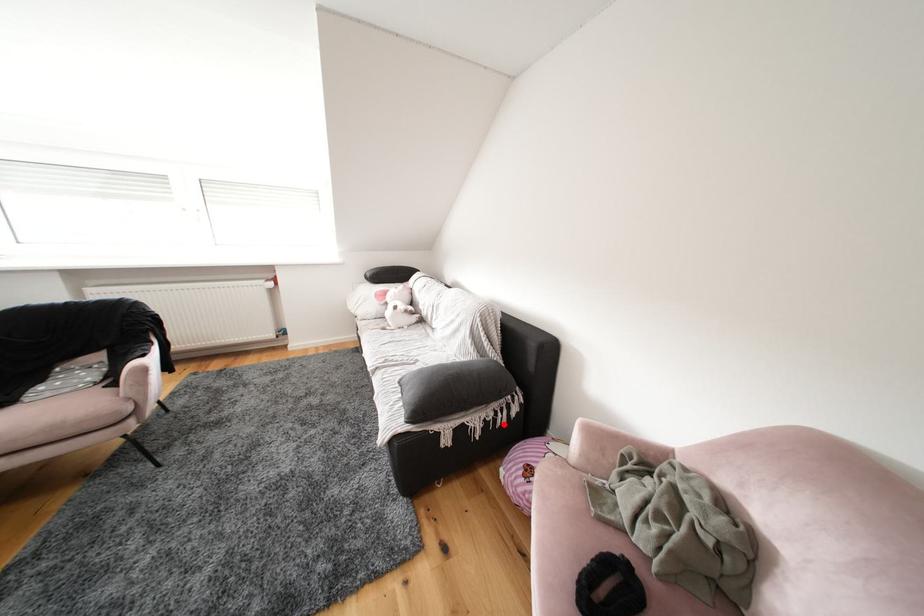
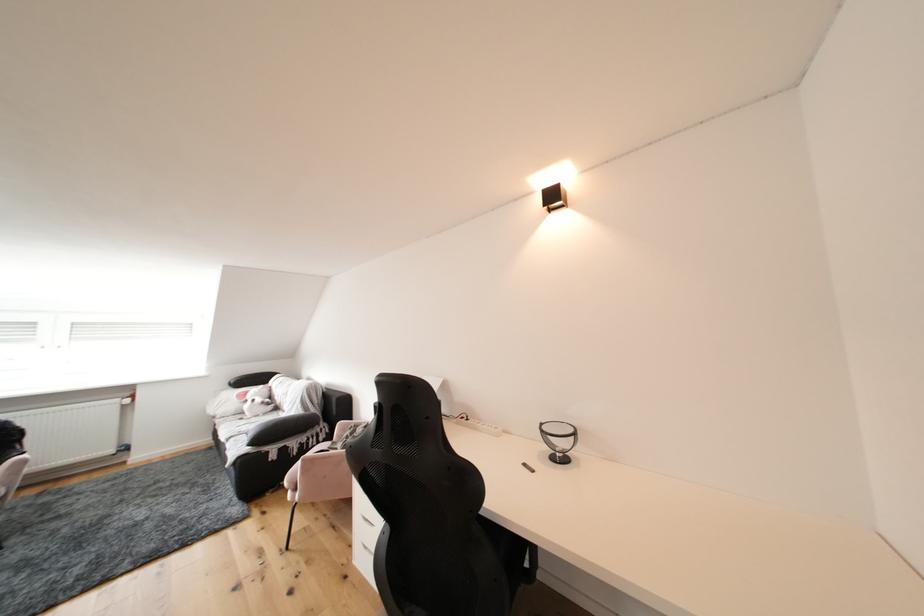
The point at the highlighted location is marked in the first image. Where is the corresponding point in the second image?

(317, 447)